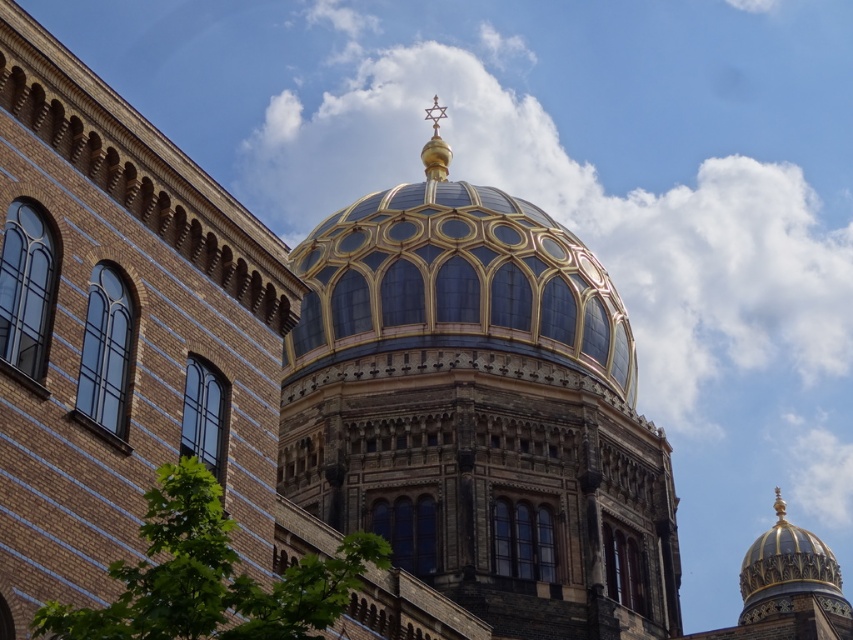
Question: Does gold-gilded dome at center appear on the left side of gold/gilded dome at center?

Choices:
 (A) no
 (B) yes

Answer: (B)

Question: Which object appears closest to the camera in this image?

Choices:
 (A) gold/gilded dome at center
 (B) gold-gilded dome at center

Answer: (B)

Question: Is gold-gilded dome at center in front of gold/gilded dome at center?

Choices:
 (A) no
 (B) yes

Answer: (B)

Question: Which point is farther from the camera taking this photo?

Choices:
 (A) (828, 572)
 (B) (541, 323)

Answer: (A)

Question: Is gold-gilded dome at center smaller than gold/gilded dome at center?

Choices:
 (A) yes
 (B) no

Answer: (A)